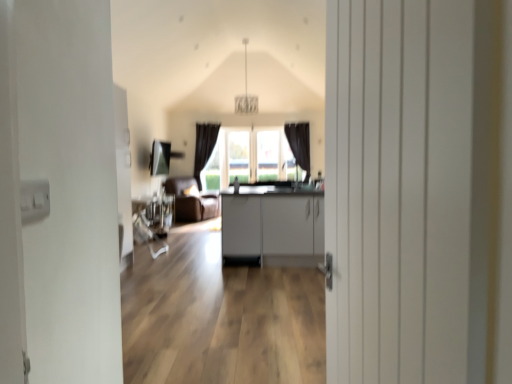
In order to face brown leather armchair at center, should I rotate leftwards or rightwards?

Rotate left and turn 8.250 degrees.

This screenshot has width=512, height=384. What do you see at coordinates (273, 226) in the screenshot?
I see `matte gray cabinets at center` at bounding box center [273, 226].

Measure the distance between point (455, 117) and camera.

Point (455, 117) and camera are 28.70 inches apart from each other.

Locate an element on the screen. This screenshot has height=384, width=512. brown leather armchair at center is located at coordinates (191, 201).

Is brown leather armchair at center inside or outside of matte gray cabinets at center?

The correct answer is: outside.

Is brown leather armchair at center positioned with its back to matte gray cabinets at center?

brown leather armchair at center is not turned away from matte gray cabinets at center.

Which object is positioned more to the left, brown leather armchair at center or matte gray cabinets at center?

brown leather armchair at center.

Looking at this image, is the depth of brown leather armchair at center less than that of matte gray cabinets at center?

No, brown leather armchair at center is behind matte gray cabinets at center.

From a real-world perspective, which object stands above the other?

white wooden door at center.

You are a GUI agent. You are given a task and a screenshot of the screen. Output one action in this format:
    pyautogui.click(x=<x>, y=<y>)
    Task: Click on the armchair on the left of white wooden door at center
    This screenshot has height=384, width=512.
    Given the screenshot: What is the action you would take?
    pyautogui.click(x=191, y=201)

From the image's perspective, between white wooden door at center and brown leather armchair at center, which one is located above?

white wooden door at center.

Does white wooden door at center come behind brown leather armchair at center?

No, it is in front of brown leather armchair at center.

From the image's perspective, is white wooden door at center located above matte gray cabinets at center?

Correct, white wooden door at center appears higher than matte gray cabinets at center in the image.

Is white wooden door at center not close to matte gray cabinets at center?

Yes, white wooden door at center and matte gray cabinets at center are quite far apart.

Who is shorter, white wooden door at center or matte gray cabinets at center?

Standing shorter between the two is matte gray cabinets at center.

Is white wooden door at center at the back of matte gray cabinets at center?

matte gray cabinets at center is not turned away from white wooden door at center.

Is matte gray cabinets at center closer to camera compared to white wooden door at center?

No, the depth of matte gray cabinets at center is greater than that of white wooden door at center.

How much distance is there between matte gray cabinets at center and white wooden door at center?

12.35 feet.

From a real-world perspective, is matte gray cabinets at center physically below white wooden door at center?

Yes, from a real-world perspective, matte gray cabinets at center is below white wooden door at center.

The height and width of the screenshot is (384, 512). I want to click on door on the right side of brown leather armchair at center, so click(x=400, y=191).

Is white wooden door at center completely or partially inside brown leather armchair at center?

No, white wooden door at center is not surrounded by brown leather armchair at center.

Considering the relative sizes of brown leather armchair at center and white wooden door at center in the image provided, is brown leather armchair at center taller than white wooden door at center?

Incorrect, the height of brown leather armchair at center is not larger of that of white wooden door at center.

Which object is more forward, brown leather armchair at center or white wooden door at center?

white wooden door at center.

How distant is matte gray cabinets at center from brown leather armchair at center?

matte gray cabinets at center is 3.39 meters away from brown leather armchair at center.

Could you tell me if matte gray cabinets at center is facing brown leather armchair at center?

No, matte gray cabinets at center is not facing towards brown leather armchair at center.

From the image's perspective, between matte gray cabinets at center and brown leather armchair at center, which one is located above?

From the image's view, brown leather armchair at center is above.

From a real-world perspective, is matte gray cabinets at center positioned above or below brown leather armchair at center?

From a real-world perspective, matte gray cabinets at center is physically below brown leather armchair at center.

Find the location of `cabinetry that is in front of the brown leather armchair at center`. cabinetry that is in front of the brown leather armchair at center is located at coordinates (273, 226).

This screenshot has width=512, height=384. I want to click on armchair to the left of white wooden door at center, so click(x=191, y=201).

When comparing their distances from matte gray cabinets at center, does brown leather armchair at center or white wooden door at center seem closer?

brown leather armchair at center is positioned closer to the anchor matte gray cabinets at center.

Which object lies nearer to the anchor point white wooden door at center, matte gray cabinets at center or brown leather armchair at center?

matte gray cabinets at center is closer to white wooden door at center.

Looking at the image, which one is located closer to brown leather armchair at center, matte gray cabinets at center or white wooden door at center?

Based on the image, matte gray cabinets at center appears to be nearer to brown leather armchair at center.

Looking at the image, which one is located further to matte gray cabinets at center, white wooden door at center or brown leather armchair at center?

Among the two, white wooden door at center is located further to matte gray cabinets at center.

Estimate the real-world distances between objects in this image. Which object is further from white wooden door at center, brown leather armchair at center or matte gray cabinets at center?

Among the two, brown leather armchair at center is located further to white wooden door at center.

Considering their positions, is white wooden door at center positioned further to brown leather armchair at center than matte gray cabinets at center?

The object further to brown leather armchair at center is white wooden door at center.

The image size is (512, 384). Identify the location of cabinetry between white wooden door at center and brown leather armchair at center in the front-back direction. (273, 226).